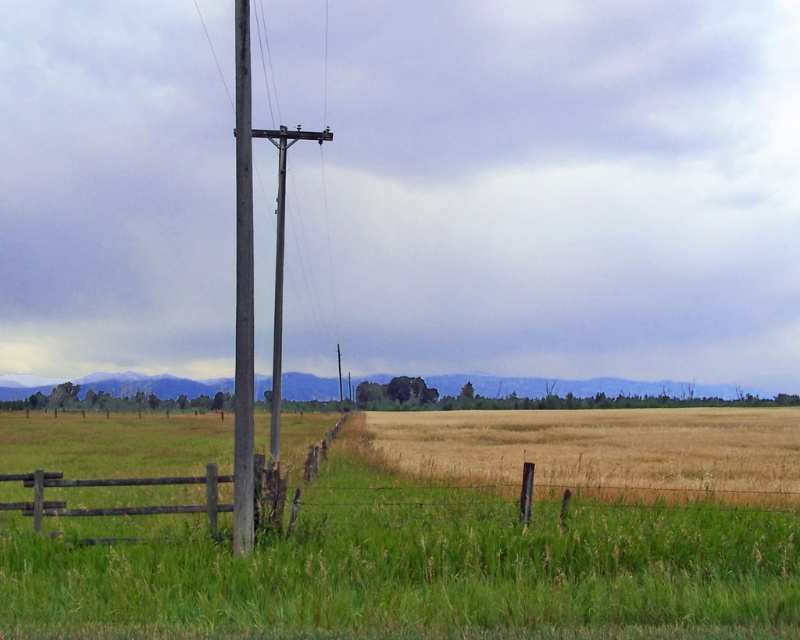
Question: Is golden dry grass at center to the left of brown wooden fence at lower left from the viewer's perspective?

Choices:
 (A) no
 (B) yes

Answer: (A)

Question: Is brown wooden fence at lower left below wooden telegraph pole at left?

Choices:
 (A) yes
 (B) no

Answer: (A)

Question: Considering the real-world distances, which object is farthest from the brown wooden fence at lower left?

Choices:
 (A) golden dry grass at center
 (B) wooden telegraph pole at left

Answer: (B)

Question: Does brown wooden fence at lower left come behind wooden telegraph pole at left?

Choices:
 (A) yes
 (B) no

Answer: (B)

Question: Which object is closer to the camera taking this photo?

Choices:
 (A) brown wooden fence at lower left
 (B) golden dry grass at center

Answer: (A)

Question: Which point appears closest to the camera in this image?

Choices:
 (A) (154, 508)
 (B) (237, 481)
 (C) (480, 445)

Answer: (B)